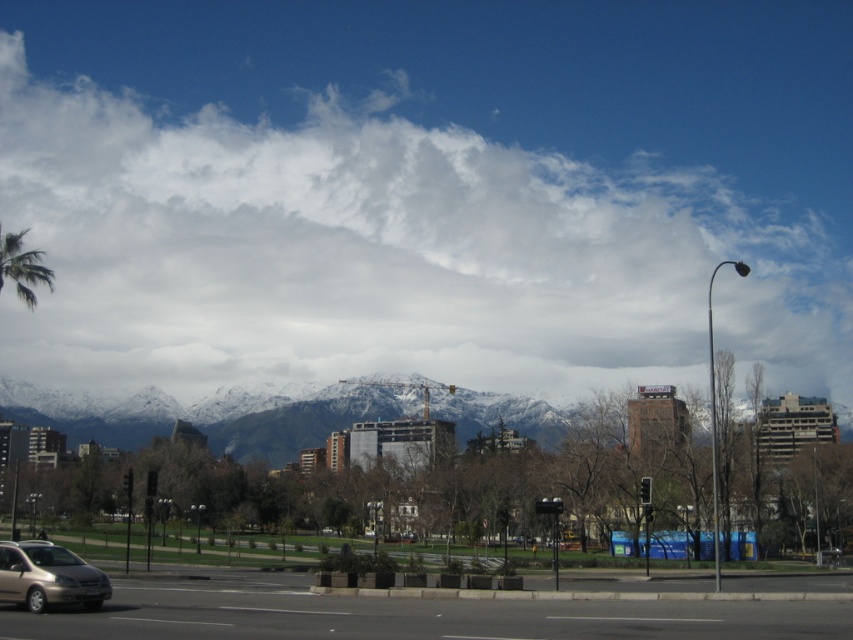
You are an airplane pilot preparing for takeoff. You notice a white fluffy cloud at upper center and a snowy mountain range at center in the distance. Which object is closer to your current position?

The white fluffy cloud at upper center is closer to your current position because it is further to the viewer than the snowy mountain range at center, meaning it appears nearer in the visual perspective.

You are a delivery driver approaching the intersection at point (48, 577). You see a gold metallic van at lower left. What is the direction of the gold metallic van at lower left relative to your current position?

The gold metallic van at lower left is located at point (48, 577), which is the intersection you are approaching. Since it is at lower left, it is positioned to the southwest of your current position if you are facing the intersection from the north.